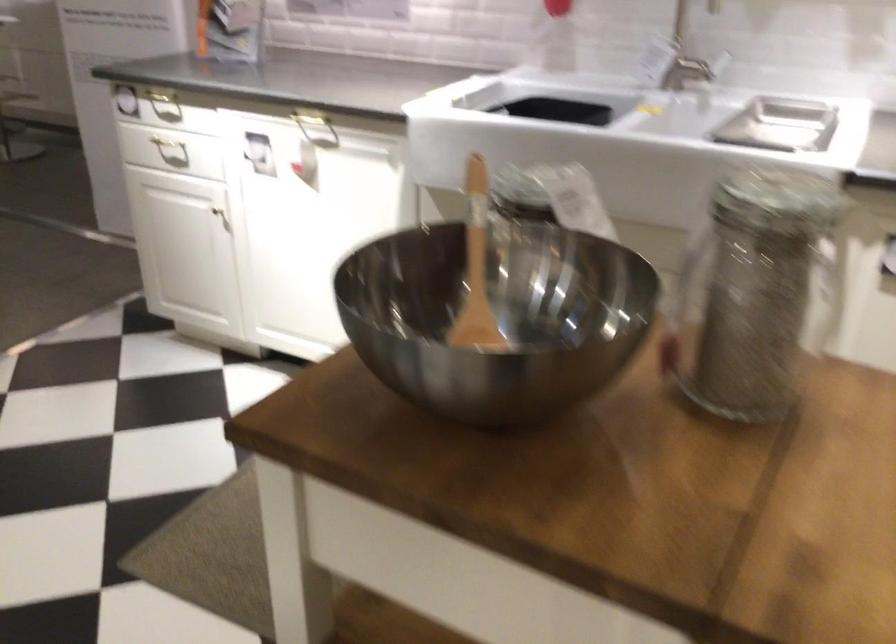
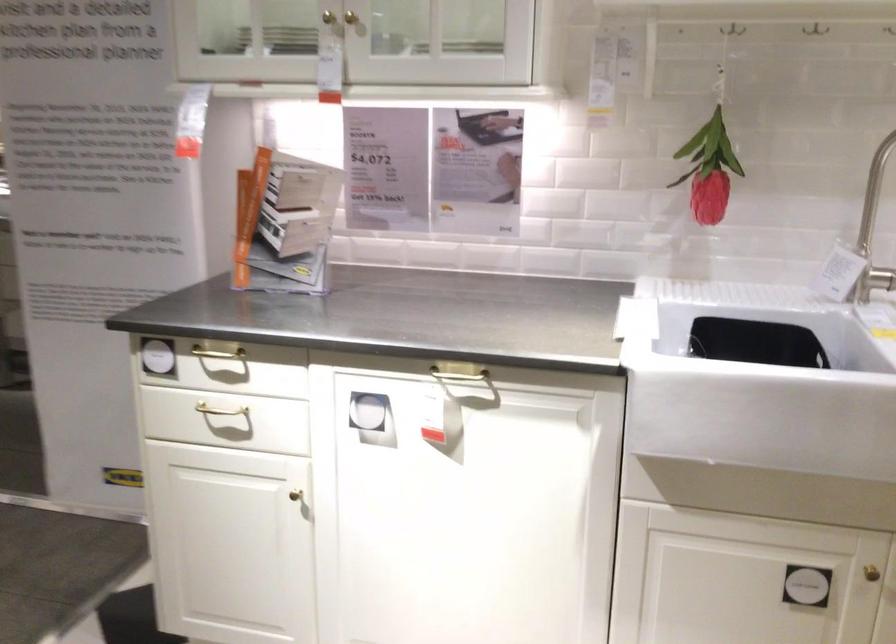
Where in the second image is the point corresponding to point 220,211 from the first image?

(296, 496)